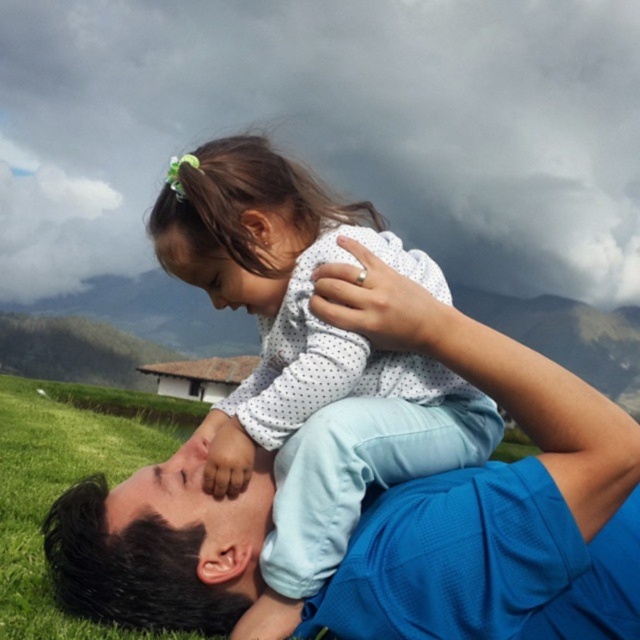
Question: Which object is the closest to the green grass at lower left?

Choices:
 (A) white dotted shirt at center
 (B) blue fabric shirt at center

Answer: (A)

Question: Does blue fabric shirt at center appear on the left side of green grass at lower left?

Choices:
 (A) no
 (B) yes

Answer: (A)

Question: In this image, where is blue fabric shirt at center located relative to white dotted shirt at center?

Choices:
 (A) right
 (B) left

Answer: (A)

Question: Which object is the closest to the blue fabric shirt at center?

Choices:
 (A) green grass at lower left
 (B) white dotted shirt at center

Answer: (B)

Question: Is blue fabric shirt at center bigger than white dotted shirt at center?

Choices:
 (A) yes
 (B) no

Answer: (B)

Question: Which is nearer to the blue fabric shirt at center?

Choices:
 (A) green grass at lower left
 (B) white dotted shirt at center

Answer: (B)